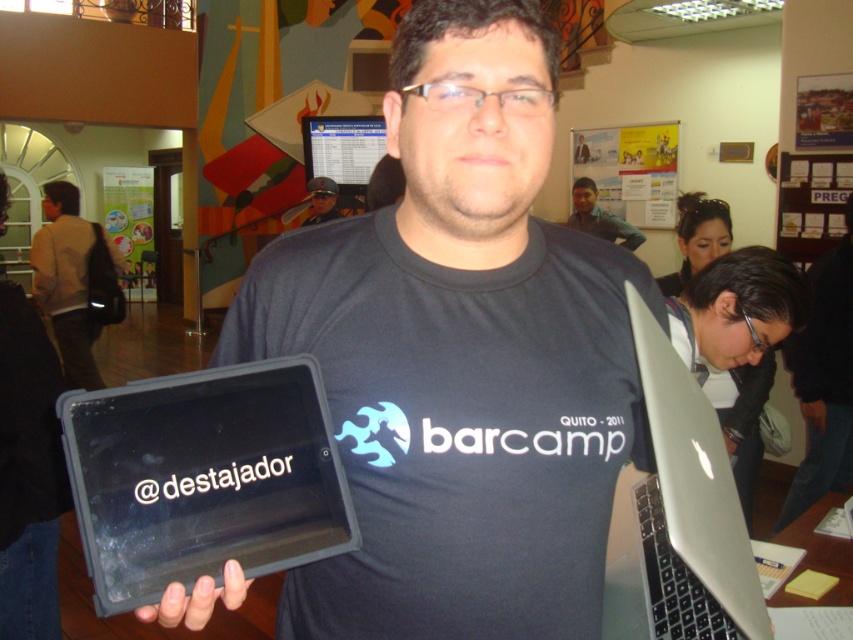
You are a photographer standing in the scene and want to take a photo of the brown leather backpack at left and the white paper poster at upper center. Given that your camera has a maximum focus range of 3.5 meters, will both objects be in focus?

The brown leather backpack at left is 3.77 meters away from the white paper poster at upper center. Since the camera can only focus up to 3.5 meters, the distance between them exceeds the focus range, so both objects cannot be in focus simultaneously.

You are organizing a tech event and need to display two devices on a stand. The stand has a height limit of 12 inches. Given the black matte tablet at left and the matte black laptop at upper center, which device would exceed the height limit if placed on the stand?

The black matte tablet at left is taller than the matte black laptop at upper center. Since the stand has a 12 inches height limit, the black matte tablet at left would exceed the height limit if placed on the stand.